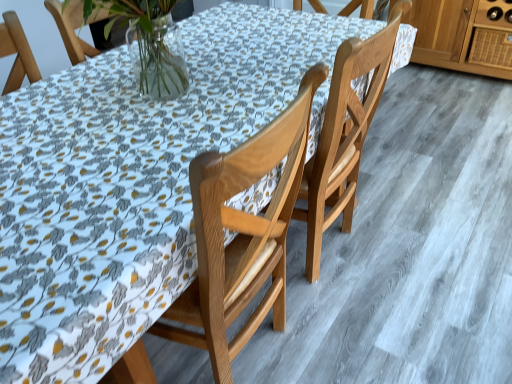
Question: From the image's perspective, does wooden drawer at upper right appear higher than light brown wood chair at center, arranged as the second chair when viewed from the left?

Choices:
 (A) no
 (B) yes

Answer: (B)

Question: Can you confirm if wooden drawer at upper right is thinner than light brown wood chair at center, which is the 1th chair in right-to-left order?

Choices:
 (A) no
 (B) yes

Answer: (B)

Question: Is the position of wooden drawer at upper right less distant than that of light brown wood chair at center, which is the 1th chair in right-to-left order?

Choices:
 (A) yes
 (B) no

Answer: (B)

Question: Is wooden drawer at upper right outside of light brown wood chair at center, which is the 1th chair in right-to-left order?

Choices:
 (A) yes
 (B) no

Answer: (A)

Question: Is wooden drawer at upper right positioned with its back to light brown wood chair at center, which is the 1th chair in right-to-left order?

Choices:
 (A) yes
 (B) no

Answer: (B)

Question: Considering their positions, is light brown wood chair at center, which is the 1th chair in right-to-left order, located in front of or behind wooden chair at center, which is the 1th chair from left to right?

Choices:
 (A) front
 (B) behind

Answer: (B)

Question: Is light brown wood chair at center, which is the 1th chair in right-to-left order, to the left or to the right of wooden chair at center, which is the 1th chair from left to right, in the image?

Choices:
 (A) left
 (B) right

Answer: (B)

Question: Is point (334, 155) positioned closer to the camera than point (227, 372)?

Choices:
 (A) closer
 (B) farther

Answer: (B)

Question: Based on their sizes in the image, would you say light brown wood chair at center, arranged as the second chair when viewed from the left, is bigger or smaller than wooden chair at center, acting as the second chair starting from the right?

Choices:
 (A) small
 (B) big

Answer: (B)

Question: Based on their positions, is wooden chair at center, which is the 1th chair from left to right, located to the left or right of wooden drawer at upper right?

Choices:
 (A) left
 (B) right

Answer: (A)

Question: Considering the positions of wooden chair at center, acting as the second chair starting from the right, and wooden drawer at upper right in the image, is wooden chair at center, acting as the second chair starting from the right, wider or thinner than wooden drawer at upper right?

Choices:
 (A) thin
 (B) wide

Answer: (B)

Question: From a real-world perspective, is wooden chair at center, acting as the second chair starting from the right, above or below wooden drawer at upper right?

Choices:
 (A) above
 (B) below

Answer: (A)

Question: Is wooden chair at center, which is the 1th chair from left to right, bigger or smaller than wooden drawer at upper right?

Choices:
 (A) big
 (B) small

Answer: (A)

Question: From the image's perspective, is wooden drawer at upper right positioned above or below wooden chair at center, acting as the second chair starting from the right?

Choices:
 (A) above
 (B) below

Answer: (A)

Question: Choose the correct answer: Is wooden drawer at upper right inside wooden chair at center, acting as the second chair starting from the right, or outside it?

Choices:
 (A) outside
 (B) inside

Answer: (A)